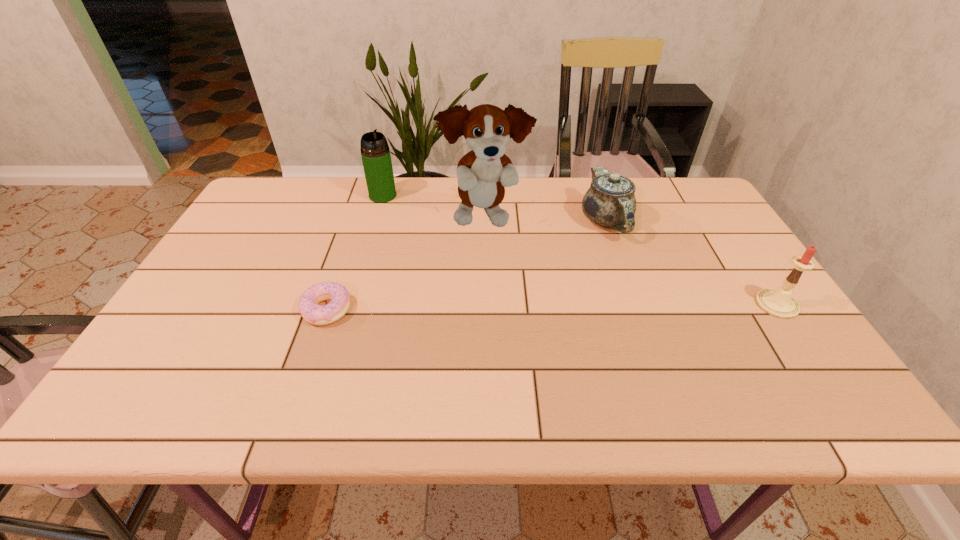
Find the location of a particular element. vacant area located 0.080m on the face of the tallest object is located at coordinates (511, 260).

Identify the location of blank space located on the face of the tallest object. The width and height of the screenshot is (960, 540). (536, 299).

Identify the location of free region located from the spout of the second tallest object. (435, 247).

Image resolution: width=960 pixels, height=540 pixels. What are the coordinates of `vacant space located 0.150m from the spout of the second tallest object` in the screenshot? It's located at (413, 225).

In order to click on vacant region located from the spout of the second tallest object in this screenshot , I will do `click(401, 214)`.

At what (x,y) coordinates should I click in order to perform the action: click on vacant space situated 0.250m from the spout of the chinaware. Please return your answer as a coordinate pair (x, y). Looking at the image, I should click on click(x=623, y=312).

At what (x,y) coordinates should I click in order to perform the action: click on blank space located 0.100m from the spout of the chinaware. Please return your answer as a coordinate pair (x, y). Looking at the image, I should click on (615, 270).

Identify the location of free region located from the spout of the chinaware. The height and width of the screenshot is (540, 960). (630, 352).

Where is `puppy that is at the far edge`? This screenshot has height=540, width=960. puppy that is at the far edge is located at coordinates (482, 173).

Image resolution: width=960 pixels, height=540 pixels. I want to click on thermos bottle positioned at the far edge, so click(375, 152).